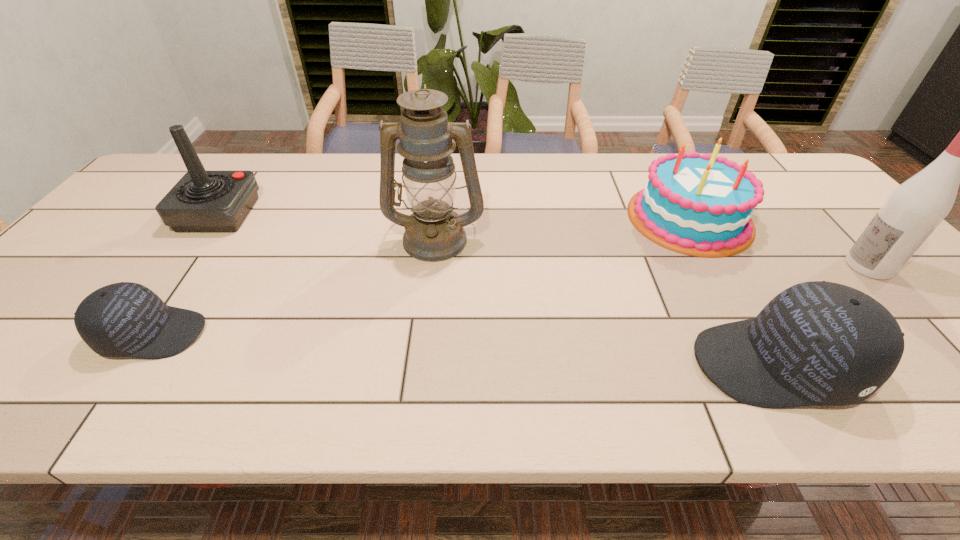
This screenshot has width=960, height=540. Find the location of `vacant space that satisfies the following two spatial constraints: 1. on the front-facing side of the birthday cake; 2. on the right side of the joystick`. vacant space that satisfies the following two spatial constraints: 1. on the front-facing side of the birthday cake; 2. on the right side of the joystick is located at coordinates (216, 218).